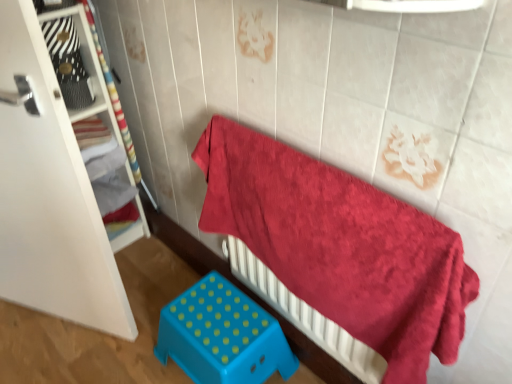
Find the location of a particular element. Image resolution: width=512 pixels, height=384 pixels. blank space above fluffy red towel at upper right (from a real-world perspective) is located at coordinates (348, 181).